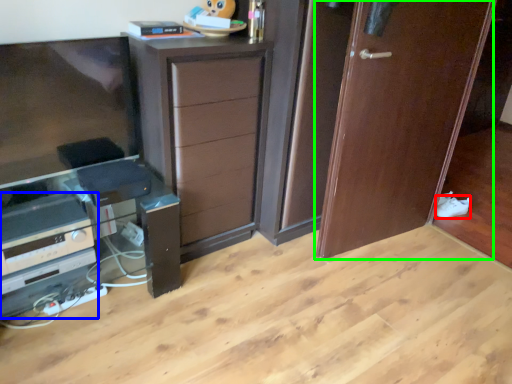
Question: Which object is the closest to the shoe (highlighted by a red box)? Choose among these: appliance (highlighted by a blue box) or door (highlighted by a green box).

Choices:
 (A) appliance
 (B) door

Answer: (B)